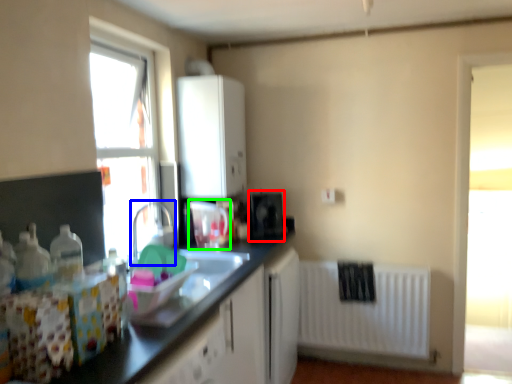
Question: Estimate the real-world distances between objects in this image. Which object is farther from appliance (highlighted by a red box), faucet (highlighted by a blue box) or appliance (highlighted by a green box)?

Choices:
 (A) faucet
 (B) appliance

Answer: (A)